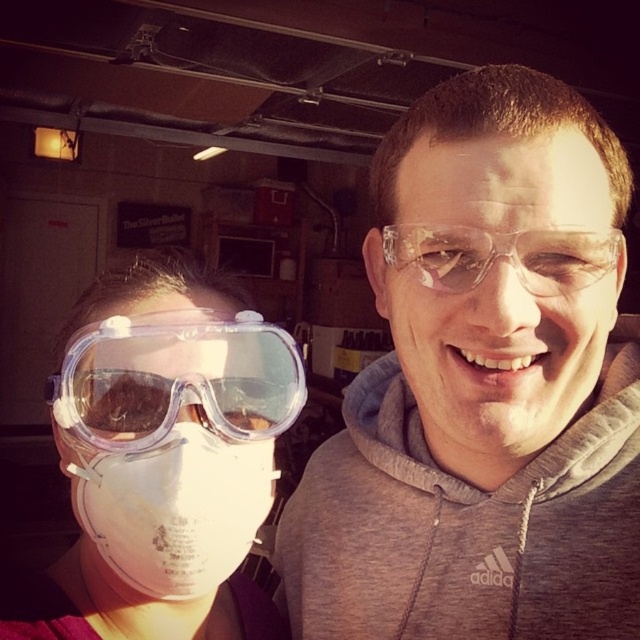
The width and height of the screenshot is (640, 640). What do you see at coordinates (481, 388) in the screenshot? I see `clear plastic glasses at center` at bounding box center [481, 388].

Does point (582, 224) come in front of point (252, 323)?

Yes, it is.

Identify the location of clear plastic glasses at center. The width and height of the screenshot is (640, 640). (481, 388).

This screenshot has width=640, height=640. I want to click on clear plastic glasses at center, so click(x=481, y=388).

Is clear plastic glasses at center further to camera compared to clear plastic goggles at left?

No.

Does clear plastic glasses at center appear on the left side of clear plastic goggles at left?

Incorrect, clear plastic glasses at center is not on the left side of clear plastic goggles at left.

This screenshot has height=640, width=640. What are the coordinates of `clear plastic glasses at center` in the screenshot? It's located at (481, 388).

In order to click on clear plastic glasses at center in this screenshot , I will do `click(481, 388)`.

Is point (145, 637) behind point (230, 353)?

Yes, point (145, 637) is behind point (230, 353).

Is clear plastic goggles at left above transparent plastic goggles at left?

Incorrect, clear plastic goggles at left is not positioned above transparent plastic goggles at left.

Identify the location of clear plastic goggles at left. (161, 460).